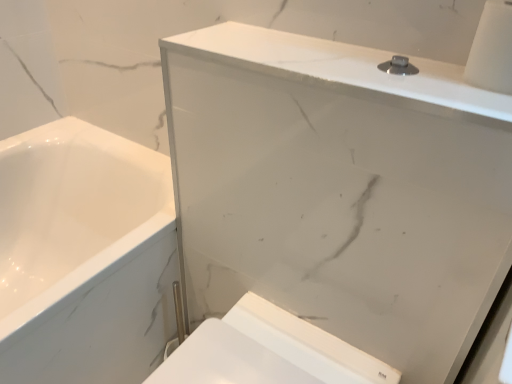
Question: Can you confirm if white marble medicine cabinet at upper center is positioned to the left of white glossy toilet at lower right?

Choices:
 (A) no
 (B) yes

Answer: (A)

Question: Is white marble medicine cabinet at upper center thinner than white glossy toilet at lower right?

Choices:
 (A) yes
 (B) no

Answer: (A)

Question: Can you confirm if white marble medicine cabinet at upper center is shorter than white glossy toilet at lower right?

Choices:
 (A) yes
 (B) no

Answer: (B)

Question: Is the position of white marble medicine cabinet at upper center less distant than that of white glossy toilet at lower right?

Choices:
 (A) yes
 (B) no

Answer: (A)

Question: From the image's perspective, is white marble medicine cabinet at upper center under white glossy toilet at lower right?

Choices:
 (A) yes
 (B) no

Answer: (B)

Question: Is white glossy toilet at lower right surrounded by white marble medicine cabinet at upper center?

Choices:
 (A) yes
 (B) no

Answer: (B)

Question: Does white glossy toilet at lower right have a greater height compared to white marble medicine cabinet at upper center?

Choices:
 (A) no
 (B) yes

Answer: (A)

Question: Can you confirm if white glossy toilet at lower right is positioned to the left of white marble medicine cabinet at upper center?

Choices:
 (A) no
 (B) yes

Answer: (B)

Question: Is white glossy toilet at lower right in front of white marble medicine cabinet at upper center?

Choices:
 (A) no
 (B) yes

Answer: (A)

Question: Is white glossy toilet at lower right at the right side of white marble medicine cabinet at upper center?

Choices:
 (A) yes
 (B) no

Answer: (B)

Question: Are white glossy toilet at lower right and white marble medicine cabinet at upper center located far from each other?

Choices:
 (A) yes
 (B) no

Answer: (B)

Question: From the image's perspective, does white glossy toilet at lower right appear lower than white marble medicine cabinet at upper center?

Choices:
 (A) no
 (B) yes

Answer: (B)

Question: Visually, is white marble medicine cabinet at upper center positioned to the left or to the right of white glossy toilet at lower right?

Choices:
 (A) right
 (B) left

Answer: (A)